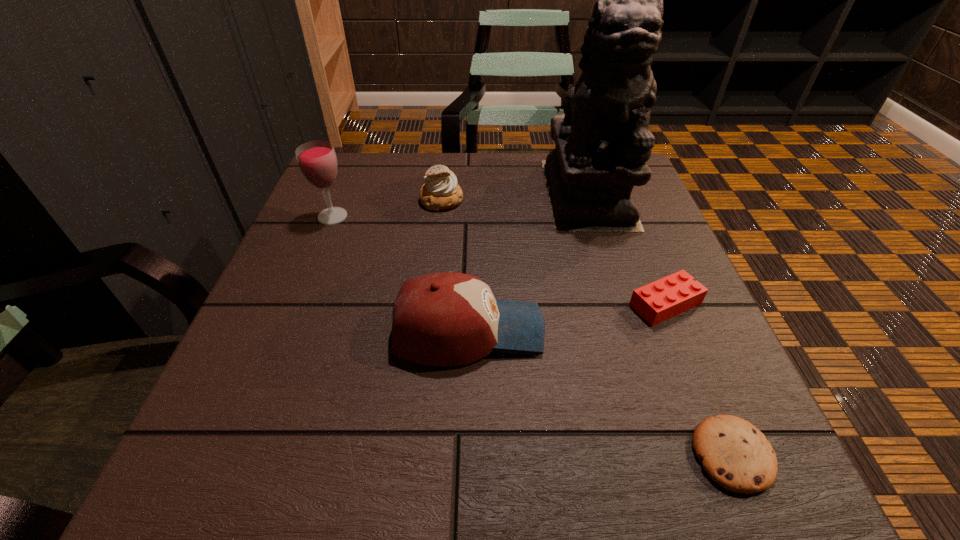
Locate an element on the screen. The image size is (960, 540). free space between the leftmost object and the third shortest object is located at coordinates (387, 208).

At what (x,y) coordinates should I click in order to perform the action: click on free area in between the fourth shortest object and the fifth shortest object. Please return your answer as a coordinate pair (x, y). This screenshot has height=540, width=960. Looking at the image, I should click on (400, 274).

The height and width of the screenshot is (540, 960). In order to click on vacant area that lies between the tallest object and the second shortest object in this screenshot , I will do `click(627, 248)`.

You are a GUI agent. You are given a task and a screenshot of the screen. Output one action in this format:
    pyautogui.click(x=<x>, y=<y>)
    Task: Click on the blank region between the third tallest object and the wineglass
    
    Given the screenshot: What is the action you would take?
    pyautogui.click(x=400, y=274)

Identify the location of free spot between the baseball cap and the tallest object. (528, 262).

This screenshot has width=960, height=540. What are the coordinates of `vacant point located between the wineglass and the sculpture` in the screenshot? It's located at (460, 205).

This screenshot has height=540, width=960. In order to click on free space that is in between the leftmost object and the Lego in this screenshot , I will do `click(499, 260)`.

The image size is (960, 540). Find the location of `vacant point located between the wineglass and the Lego`. vacant point located between the wineglass and the Lego is located at coordinates (499, 260).

Identify the location of the fourth closest object relative to the baseball cap. (317, 161).

Locate an element on the screen. object that is the nearest to the fifth tallest object is located at coordinates [603, 142].